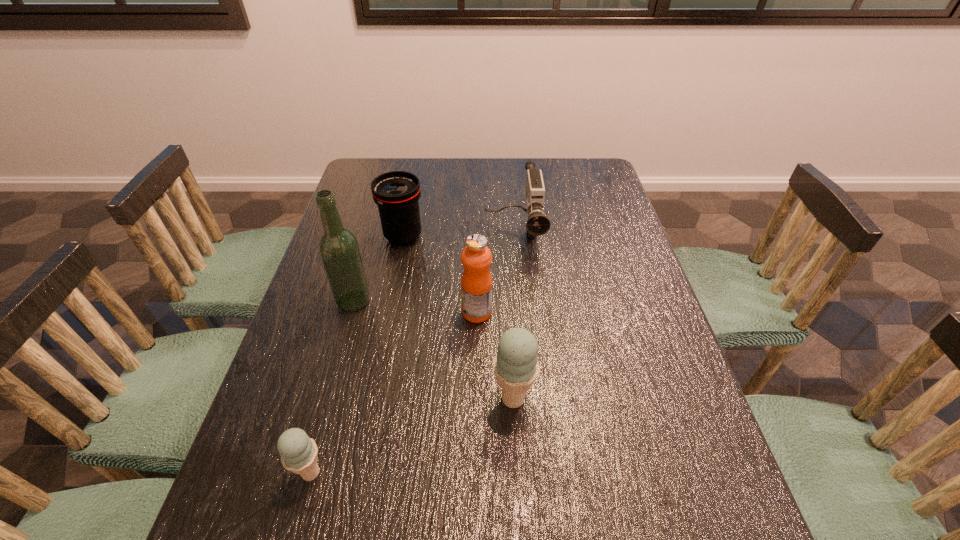
You are a GUI agent. You are given a task and a screenshot of the screen. Output one action in this format:
    pyautogui.click(x=<x>, y=<y>)
    Task: Click on the vacant space at the near edge of the desktop
    
    Given the screenshot: What is the action you would take?
    pyautogui.click(x=374, y=448)

You are a GUI agent. You are given a task and a screenshot of the screen. Output one action in this format:
    pyautogui.click(x=<x>, y=<y>)
    Task: Click on the free space at the left edge of the desktop
    Image resolution: width=960 pixels, height=540 pixels.
    Given the screenshot: What is the action you would take?
    pyautogui.click(x=313, y=400)

In the image, there is a desktop. Identify the location of free space at the right edge. The height and width of the screenshot is (540, 960). (666, 367).

Find the location of a particular element. vacant space at the far left corner of the desktop is located at coordinates (360, 167).

Where is `vacant space at the far right corner of the desktop`? The width and height of the screenshot is (960, 540). vacant space at the far right corner of the desktop is located at coordinates (592, 185).

This screenshot has width=960, height=540. I want to click on vacant space in between the tallest object and the farther ice cream, so click(433, 349).

You are a GUI agent. You are given a task and a screenshot of the screen. Output one action in this format:
    pyautogui.click(x=<x>, y=<y>)
    Task: Click on the free point between the telephoto lens and the tallest object
    The height and width of the screenshot is (540, 960).
    Given the screenshot: What is the action you would take?
    pyautogui.click(x=378, y=269)

The image size is (960, 540). Identify the location of free space between the telephoto lens and the liquor. (378, 269).

Identify the location of unoccupied position between the liquor and the telephoto lens. This screenshot has width=960, height=540. (378, 269).

At what (x,y) coordinates should I click in order to perform the action: click on vacant area between the shortest object and the fruit juice. Please return your answer as a coordinate pair (x, y). This screenshot has width=960, height=540. Looking at the image, I should click on (394, 393).